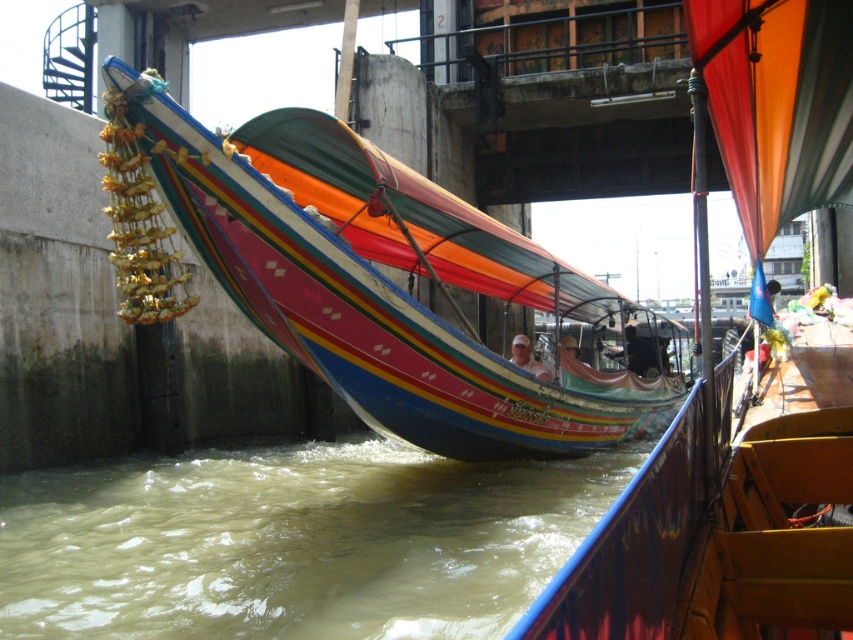
You are standing on the bridge looking down at the canal. There is a point marked at coordinates (x=293, y=541). What is located at that point?

The point at coordinates (x=293, y=541) marks brown murky water at lower left.

You are standing on the bridge looking down at the canal. You notice the brown murky water at lower left and the multicolored fabric boat at center. Which one is higher from your viewpoint?

The multicolored fabric boat at center is higher than the brown murky water at lower left from your viewpoint because the brown murky water at lower left has a lesser height compared to multicolored fabric boat at center.